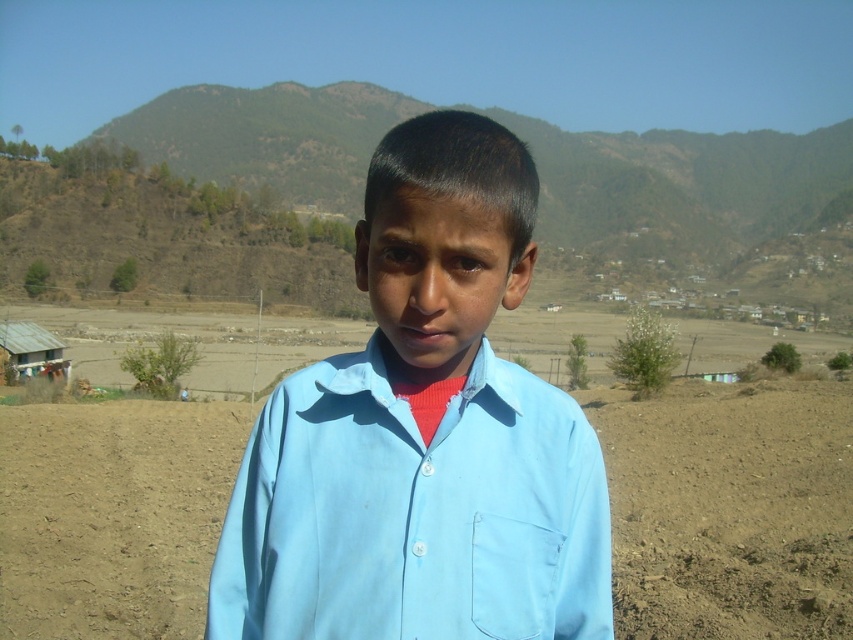
Question: Which point is farther to the camera?

Choices:
 (A) (198, 612)
 (B) (258, 520)

Answer: (A)

Question: Is light blue cotton shirt at center thinner than brown soil at center?

Choices:
 (A) yes
 (B) no

Answer: (A)

Question: Can you confirm if light blue cotton shirt at center is smaller than brown soil at center?

Choices:
 (A) yes
 (B) no

Answer: (A)

Question: Which point is closer to the camera?

Choices:
 (A) (352, 378)
 (B) (695, 444)

Answer: (A)

Question: Which point is closer to the camera taking this photo?

Choices:
 (A) (370, 541)
 (B) (45, 428)

Answer: (A)

Question: Can you confirm if light blue cotton shirt at center is positioned below brown soil at center?

Choices:
 (A) yes
 (B) no

Answer: (B)